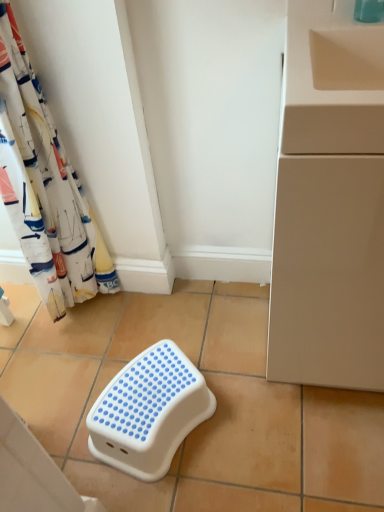
Where is `free space between beige matte cabinet at right and white fabric curtain at left`? free space between beige matte cabinet at right and white fabric curtain at left is located at coordinates (x=190, y=321).